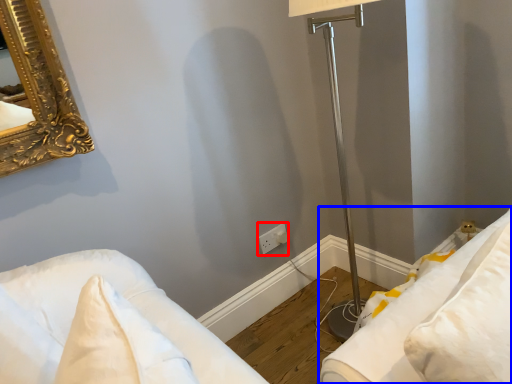
Question: Which of the following is the farthest to the observer, electric outlet (highlighted by a red box) or furniture (highlighted by a blue box)?

Choices:
 (A) electric outlet
 (B) furniture

Answer: (A)